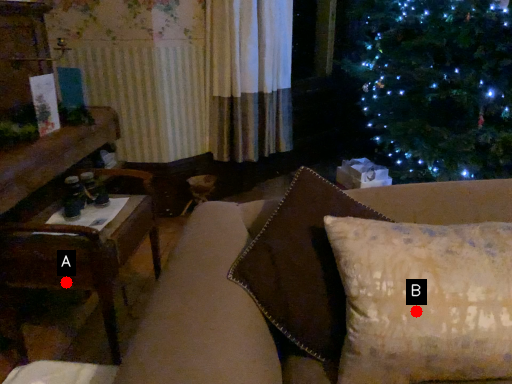
Question: Two points are circled on the image, labeled by A and B beside each circle. Among these points, which one is farthest from the camera?

Choices:
 (A) A is further
 (B) B is further

Answer: (A)